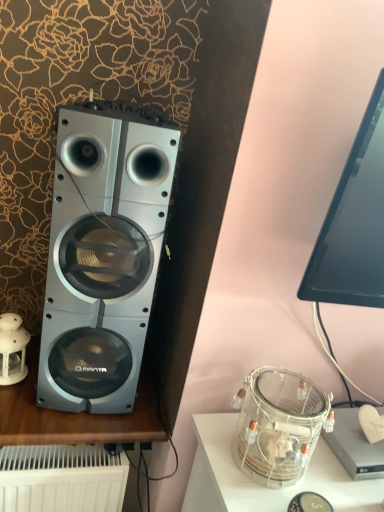
Question: Considering the positions of black glossy monitor at upper right and silver metallic speaker at left in the image, is black glossy monitor at upper right taller or shorter than silver metallic speaker at left?

Choices:
 (A) short
 (B) tall

Answer: (A)

Question: Considering their positions, is black glossy monitor at upper right located in front of or behind silver metallic speaker at left?

Choices:
 (A) behind
 (B) front

Answer: (B)

Question: Which is farther from the white porcelain lantern at left?

Choices:
 (A) black glossy monitor at upper right
 (B) silver metallic speaker at left
 (C) clear glass jar at lower right
 (D) clear glass jar at lower right

Answer: (A)

Question: Which object is positioned closest to the black glossy monitor at upper right?

Choices:
 (A) clear glass jar at lower right
 (B) white porcelain lantern at left
 (C) clear glass jar at lower right
 (D) silver metallic speaker at left

Answer: (C)